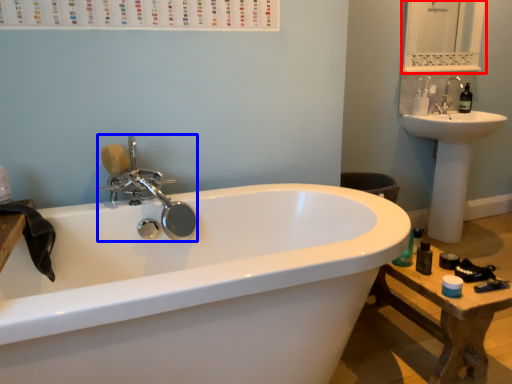
Question: Which point is further to the camera, medicine cabinet (highlighted by a red box) or tap (highlighted by a blue box)?

Choices:
 (A) medicine cabinet
 (B) tap

Answer: (A)